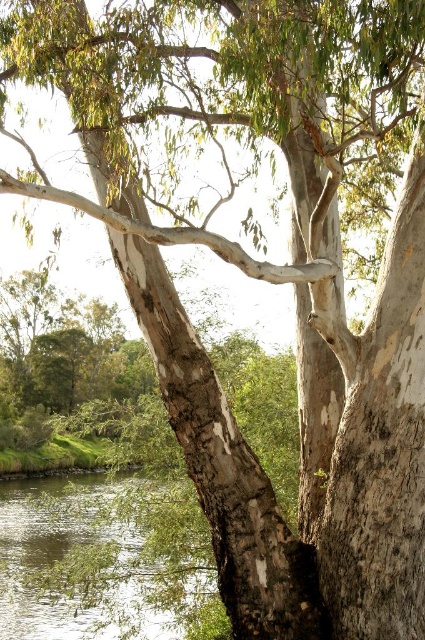
Question: Does white rough bark tree trunk at center appear over clear water at lower left?

Choices:
 (A) yes
 (B) no

Answer: (A)

Question: Observing the image, what is the correct spatial positioning of white rough bark tree trunk at center in reference to clear water at lower left?

Choices:
 (A) below
 (B) above

Answer: (B)

Question: Is white rough bark tree trunk at center to the right of clear water at lower left from the viewer's perspective?

Choices:
 (A) yes
 (B) no

Answer: (A)

Question: Which object is closer to the camera taking this photo?

Choices:
 (A) clear water at lower left
 (B) white rough bark tree trunk at center

Answer: (B)

Question: Which of the following is the farthest from the observer?

Choices:
 (A) (99, 157)
 (B) (104, 481)

Answer: (B)